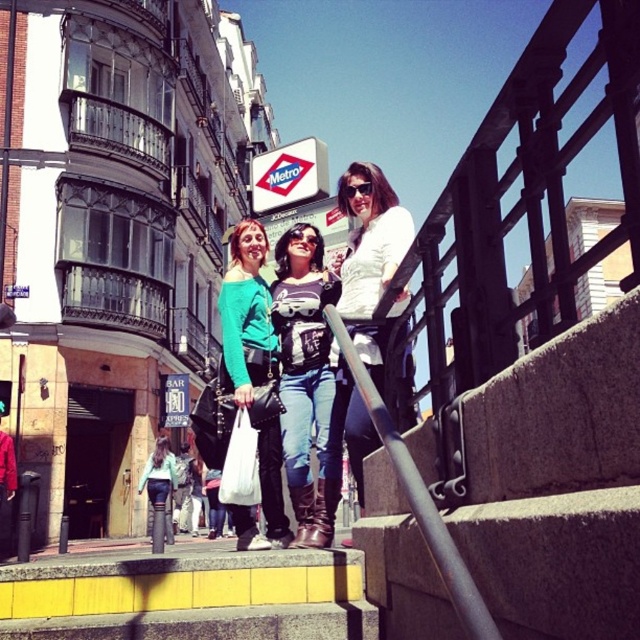
Is the position of denim jeans at lower left less distant than that of black plastic sunglasses at center?

No.

Does denim jeans at lower left have a larger size compared to black plastic sunglasses at center?

Indeed, denim jeans at lower left has a larger size compared to black plastic sunglasses at center.

Find the location of a particular element. Image resolution: width=640 pixels, height=640 pixels. denim jeans at lower left is located at coordinates (160, 480).

In order to click on denim jeans at lower left in this screenshot , I will do `click(160, 480)`.

Can you confirm if concrete stairs at lower right is bigger than denim jeans at center?

Correct, concrete stairs at lower right is larger in size than denim jeans at center.

At what (x,y) coordinates should I click in order to perform the action: click on concrete stairs at lower right. Please return your answer as a coordinate pair (x, y). This screenshot has height=640, width=640. Looking at the image, I should click on click(x=557, y=484).

Is point (563, 532) farther from viewer compared to point (294, 307)?

No.

Identify the location of concrete stairs at lower right. Image resolution: width=640 pixels, height=640 pixels. (557, 484).

Does denim jeans at center have a smaller size compared to white matte jacket at upper center?

Yes, denim jeans at center is smaller than white matte jacket at upper center.

Which is behind, point (310, 353) or point (356, 262)?

The point (310, 353) is behind.

The image size is (640, 640). Describe the element at coordinates (307, 380) in the screenshot. I see `denim jeans at center` at that location.

You are a GUI agent. You are given a task and a screenshot of the screen. Output one action in this format:
    pyautogui.click(x=<x>, y=<y>)
    Task: Click on the denim jeans at center
    The image size is (640, 640).
    Given the screenshot: What is the action you would take?
    pyautogui.click(x=307, y=380)